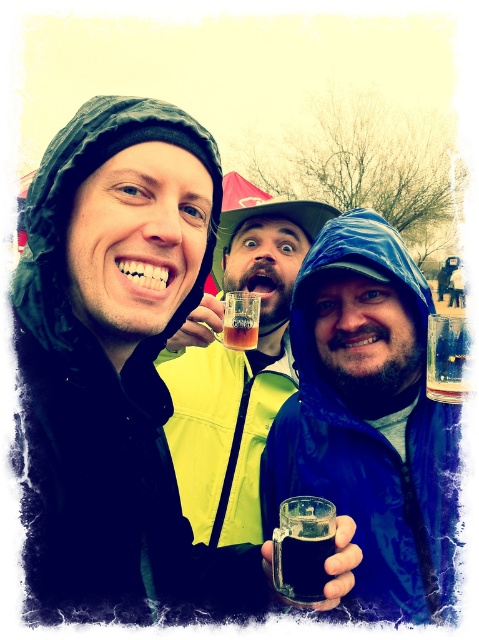
Is point (377, 589) positioned after point (318, 564)?

Yes.

Can you confirm if translucent glass mug at center is taller than dark glass mug at center?

Yes, translucent glass mug at center is taller than dark glass mug at center.

Which is in front, point (399, 620) or point (276, 554)?

Positioned in front is point (276, 554).

Identify the location of translucent glass mug at center. (369, 420).

Is translucent glass mug at center positioned at the back of matte plastic cup at center?

No, it is not.

What do you see at coordinates (369, 420) in the screenshot?
I see `translucent glass mug at center` at bounding box center [369, 420].

The image size is (479, 640). I want to click on translucent glass mug at center, so click(x=369, y=420).

Measure the distance between dark glass mug at center and camera.

dark glass mug at center and camera are 35.55 inches apart.

Who is more forward, (312, 504) or (228, 348)?

Positioned in front is point (312, 504).

Between point (280, 572) and point (230, 310), which one is positioned in front?

Point (280, 572)

The height and width of the screenshot is (640, 479). Identify the location of dark glass mug at center. (303, 547).